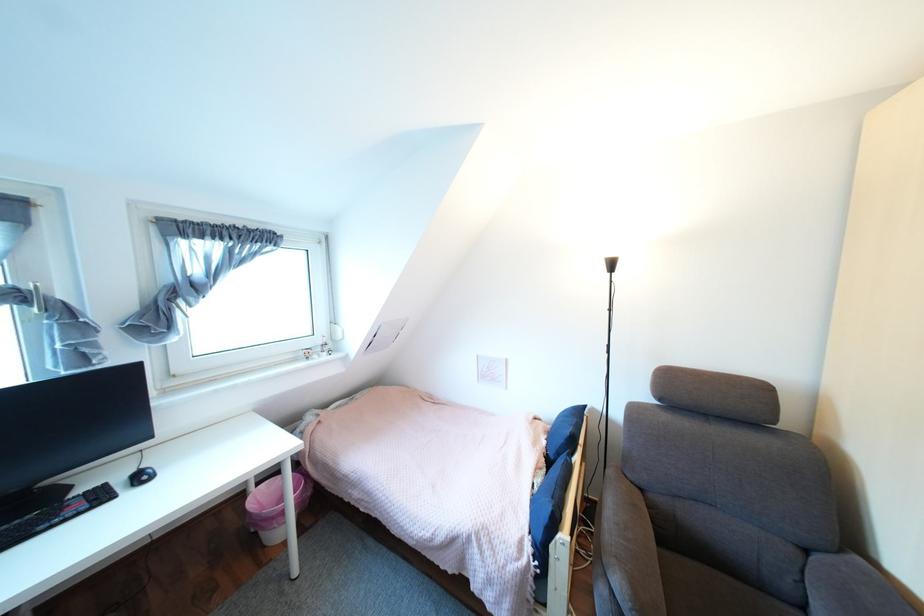
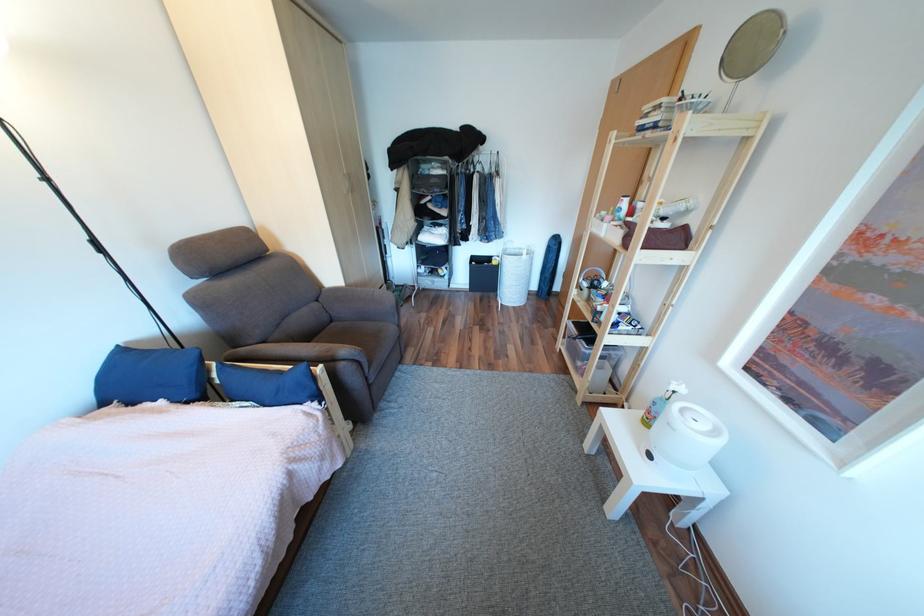
Based on the continuous images, in which direction is the camera rotating?

The camera's rotation is toward right-down.